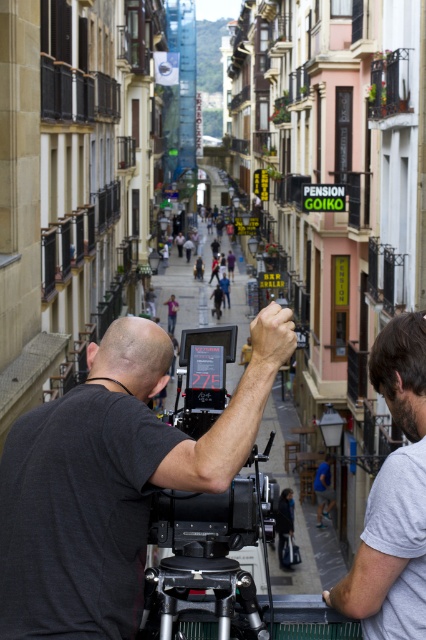
Question: Does gray cotton shirt at right have a greater width compared to silver metallic tripod at center?

Choices:
 (A) no
 (B) yes

Answer: (A)

Question: Is gray cotton shirt at right positioned in front of silver metallic tripod at center?

Choices:
 (A) no
 (B) yes

Answer: (B)

Question: Which point appears farthest from the camera in this image?

Choices:
 (A) (368, 620)
 (B) (247, 452)

Answer: (A)

Question: Which point is closer to the camera taking this photo?

Choices:
 (A) (42, 627)
 (B) (394, 561)
 (C) (218, 593)

Answer: (A)

Question: Among these points, which one is nearest to the camera?

Choices:
 (A) (224, 593)
 (B) (132, 524)
 (C) (391, 372)

Answer: (B)

Question: Is black matte camera at center above silver metallic tripod at center?

Choices:
 (A) no
 (B) yes

Answer: (B)